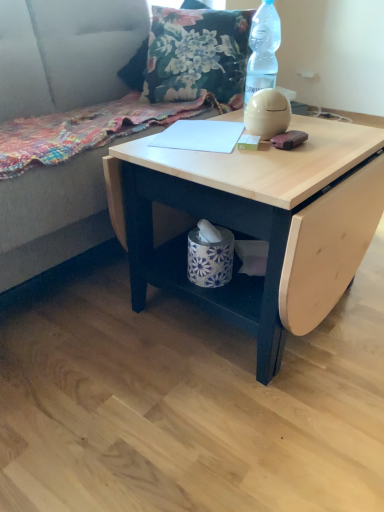
I want to click on free space on the front side of light wood table at center, so click(x=227, y=421).